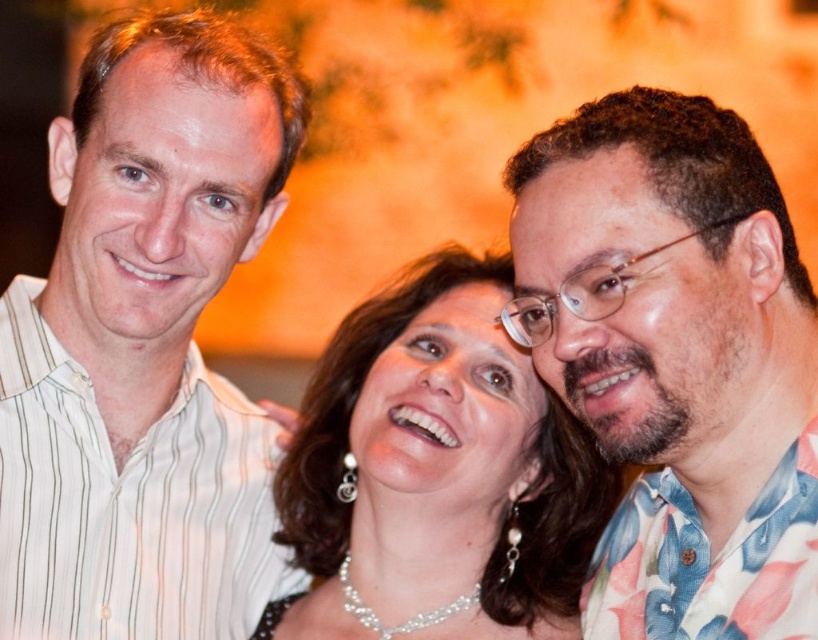
Based on the photo, you are a photographer standing 4 feet away from the camera. You need to adjust the focus to capture the white striped shirt at left clearly. Is the current distance sufficient?

The white striped shirt at left and camera are 3.92 feet apart. Since you are standing 4 feet away from the camera, the distance is sufficient to focus on the white striped shirt at left.